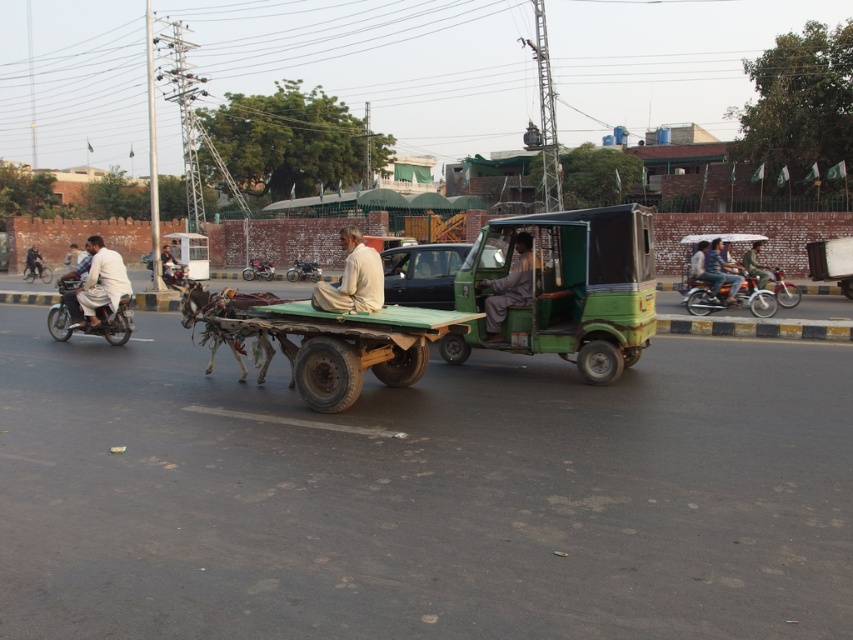
Between point (712, 275) and point (173, 262), which one is positioned in front?

Point (712, 275)

Which is behind, point (706, 262) or point (161, 273)?

Positioned behind is point (161, 273).

You are a GUI agent. You are given a task and a screenshot of the screen. Output one action in this format:
    pyautogui.click(x=<x>, y=<y>)
    Task: Click on the jeans at center
    This screenshot has height=640, width=853.
    Given the screenshot: What is the action you would take?
    pyautogui.click(x=720, y=272)

Where is `brown leather donkey at center`? brown leather donkey at center is located at coordinates (229, 324).

Which is below, light brown leather jacket at center or dark brown leather jacket at left?

dark brown leather jacket at left is below.

Can you confirm if light brown leather jacket at center is positioned to the left of dark brown leather jacket at left?

Incorrect, light brown leather jacket at center is not on the left side of dark brown leather jacket at left.

Is point (178, 268) closer to camera compared to point (33, 276)?

Yes.

Identify the location of light brown leather jacket at center. The image size is (853, 640). [170, 266].